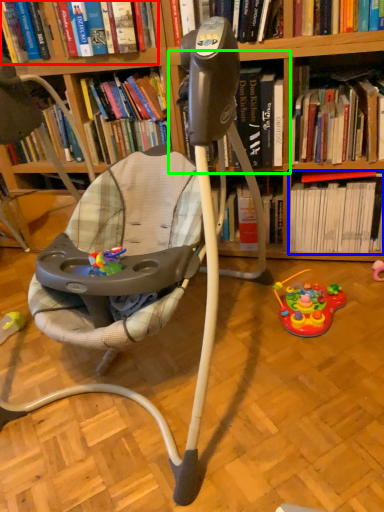
Question: Estimate the real-world distances between objects in this image. Which object is closer to book (highlighted by a red box), book (highlighted by a blue box) or shelf (highlighted by a green box)?

Choices:
 (A) book
 (B) shelf

Answer: (B)